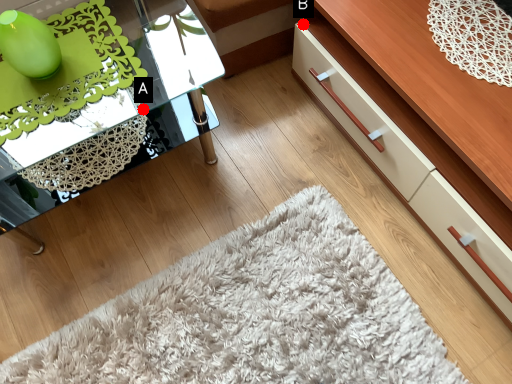
Question: Two points are circled on the image, labeled by A and B beside each circle. Which point is further to the camera?

Choices:
 (A) A is further
 (B) B is further

Answer: (B)